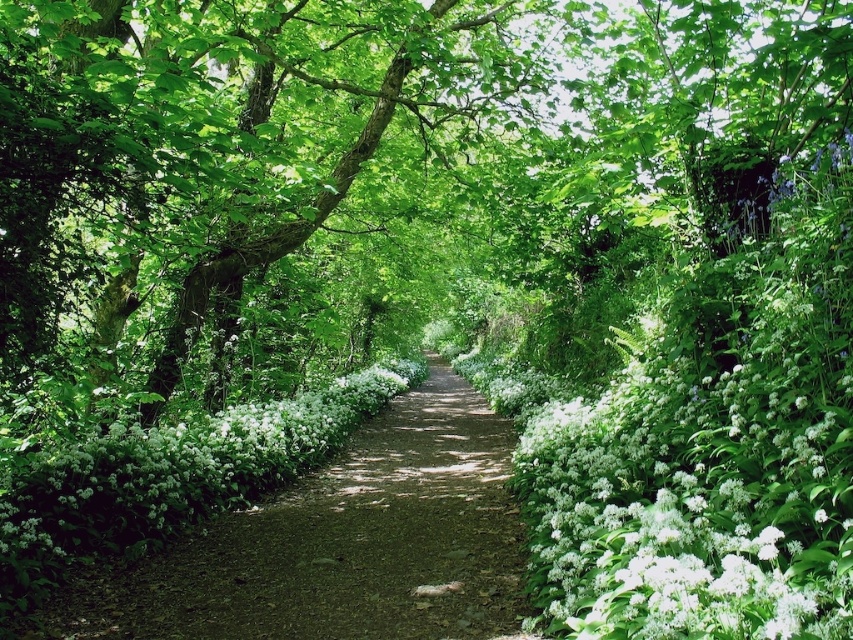
You are standing on the pathway and want to reach the point at coordinates point (100, 16). Given that your walking speed is 1.5 meters per second, how many seconds will it take you to reach that point?

The point (100, 16) is 4.30 meters away from the viewer. At a walking speed of 1.5 meters per second, it will take approximately 2.87 seconds to reach the point.

You are a gardener who wants to plant a new tree in the pathway. The existing green leafy tree at center and white matte flowers at center are already there. Which object is smaller and should be considered when planning space requirements?

The green leafy tree at center has a smaller size compared to white matte flowers at center, so it is the smaller object and should be considered when planning space requirements.